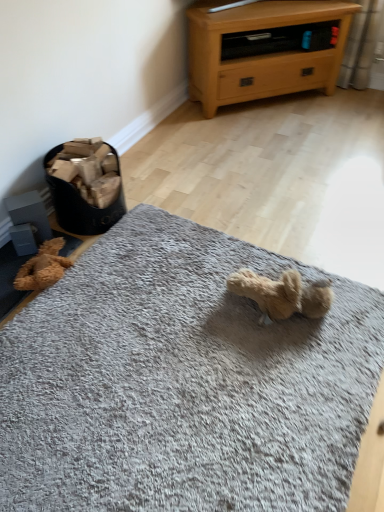
Identify the location of gray soft rug at center. The image size is (384, 512). (182, 382).

You are a GUI agent. You are given a task and a screenshot of the screen. Output one action in this format:
    pyautogui.click(x=<x>, y=<y>)
    Task: Click on the brown plush teddy bear at lower left
    
    Given the screenshot: What is the action you would take?
    pyautogui.click(x=43, y=267)

Is brown plush teddy bear at lower left facing away from light oak wood chest of drawers at upper right?

No, brown plush teddy bear at lower left is not facing the opposite direction of light oak wood chest of drawers at upper right.

Considering the relative sizes of brown plush teddy bear at lower left and light oak wood chest of drawers at upper right in the image provided, is brown plush teddy bear at lower left taller than light oak wood chest of drawers at upper right?

No, brown plush teddy bear at lower left is not taller than light oak wood chest of drawers at upper right.

Which of these two, brown plush teddy bear at lower left or light oak wood chest of drawers at upper right, is smaller?

brown plush teddy bear at lower left is smaller.

Looking at their sizes, would you say gray soft rug at center is wider or thinner than brown plush teddy bear at lower left?

gray soft rug at center is wider than brown plush teddy bear at lower left.

Consider the image. From a real-world perspective, is gray soft rug at center positioned under brown plush teddy bear at lower left based on gravity?

Yes.

Consider the image. From the image's perspective, is gray soft rug at center located beneath brown plush teddy bear at lower left?

Indeed, from the image's perspective, gray soft rug at center is shown beneath brown plush teddy bear at lower left.

Considering the points (217, 485) and (62, 261), which point is behind, point (217, 485) or point (62, 261)?

Positioned behind is point (62, 261).

Considering the positions of objects brown plush teddy bear at lower left and gray soft rug at center in the image provided, who is more to the right, brown plush teddy bear at lower left or gray soft rug at center?

gray soft rug at center.

In the scene shown: Is gray soft rug at center completely or partially inside brown plush teddy bear at lower left?

That's incorrect, gray soft rug at center is not inside brown plush teddy bear at lower left.

Based on the photo, from the image's perspective, would you say brown plush teddy bear at lower left is positioned over gray soft rug at center?

Yes.

Considering the points (52, 253) and (1, 495), which point is in front, point (52, 253) or point (1, 495)?

The point (1, 495) is closer to the camera.

Is light oak wood chest of drawers at upper right situated inside brown plush teddy bear at lower left or outside?

light oak wood chest of drawers at upper right is not inside brown plush teddy bear at lower left, it's outside.

Image resolution: width=384 pixels, height=512 pixels. Find the location of `chest of drawers on the right side of brown plush teddy bear at lower left`. chest of drawers on the right side of brown plush teddy bear at lower left is located at coordinates (262, 50).

Does light oak wood chest of drawers at upper right appear on the right side of brown plush teddy bear at lower left?

Yes, light oak wood chest of drawers at upper right is to the right of brown plush teddy bear at lower left.

Looking at this image, can you tell me how much light oak wood chest of drawers at upper right and brown plush teddy bear at lower left differ in facing direction?

The angular difference between light oak wood chest of drawers at upper right and brown plush teddy bear at lower left is 42.6 degrees.

From a real-world perspective, is light oak wood chest of drawers at upper right beneath gray soft rug at center?

No, from a real-world perspective, light oak wood chest of drawers at upper right is not beneath gray soft rug at center.

Is light oak wood chest of drawers at upper right located outside gray soft rug at center?

That's correct, light oak wood chest of drawers at upper right is outside of gray soft rug at center.

Does light oak wood chest of drawers at upper right have a greater height compared to gray soft rug at center?

Indeed, light oak wood chest of drawers at upper right has a greater height compared to gray soft rug at center.

Which object is thinner, light oak wood chest of drawers at upper right or gray soft rug at center?

Thinner between the two is light oak wood chest of drawers at upper right.

From a real-world perspective, is gray soft rug at center on top of light oak wood chest of drawers at upper right?

Incorrect, from a real-world perspective, gray soft rug at center is lower than light oak wood chest of drawers at upper right.

Which is closer to the camera, (319, 341) or (336, 74)?

Clearly, point (319, 341) is closer to the camera than point (336, 74).

From the image's perspective, is gray soft rug at center located above light oak wood chest of drawers at upper right?

No, from the image's perspective, gray soft rug at center is not on top of light oak wood chest of drawers at upper right.

This screenshot has height=512, width=384. Find the location of `teddy that is on the left side of light oak wood chest of drawers at upper right`. teddy that is on the left side of light oak wood chest of drawers at upper right is located at coordinates (43, 267).

You are a GUI agent. You are given a task and a screenshot of the screen. Output one action in this format:
    pyautogui.click(x=<x>, y=<y>)
    Task: Click on the teddy that is above the gray soft rug at center (from a real-world perspective)
    This screenshot has width=384, height=512.
    Given the screenshot: What is the action you would take?
    pyautogui.click(x=43, y=267)

Based on their spatial positions, is light oak wood chest of drawers at upper right or brown plush teddy bear at lower left closer to gray soft rug at center?

The object closer to gray soft rug at center is brown plush teddy bear at lower left.

Based on their spatial positions, is gray soft rug at center or brown plush teddy bear at lower left closer to light oak wood chest of drawers at upper right?

brown plush teddy bear at lower left is closer to light oak wood chest of drawers at upper right.

Which object lies further to the anchor point brown plush teddy bear at lower left, light oak wood chest of drawers at upper right or gray soft rug at center?

The object further to brown plush teddy bear at lower left is light oak wood chest of drawers at upper right.

In the scene shown: When comparing their distances from gray soft rug at center, does brown plush teddy bear at lower left or light oak wood chest of drawers at upper right seem closer?

brown plush teddy bear at lower left.

Which object lies further to the anchor point brown plush teddy bear at lower left, gray soft rug at center or light oak wood chest of drawers at upper right?

Among the two, light oak wood chest of drawers at upper right is located further to brown plush teddy bear at lower left.

From the picture: Estimate the real-world distances between objects in this image. Which object is closer to light oak wood chest of drawers at upper right, brown plush teddy bear at lower left or gray soft rug at center?

brown plush teddy bear at lower left lies closer to light oak wood chest of drawers at upper right than the other object.

I want to click on teddy between light oak wood chest of drawers at upper right and gray soft rug at center from top to bottom, so click(43, 267).